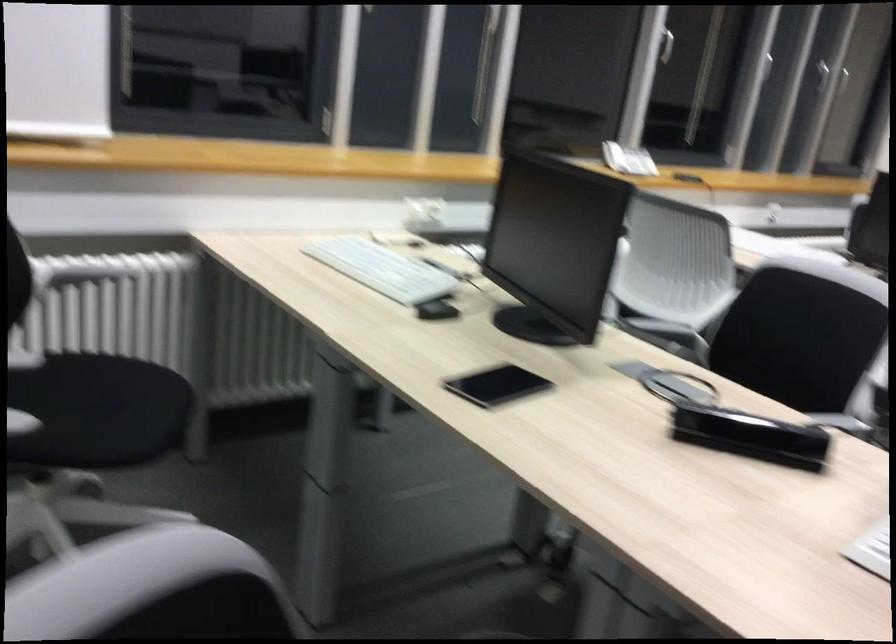
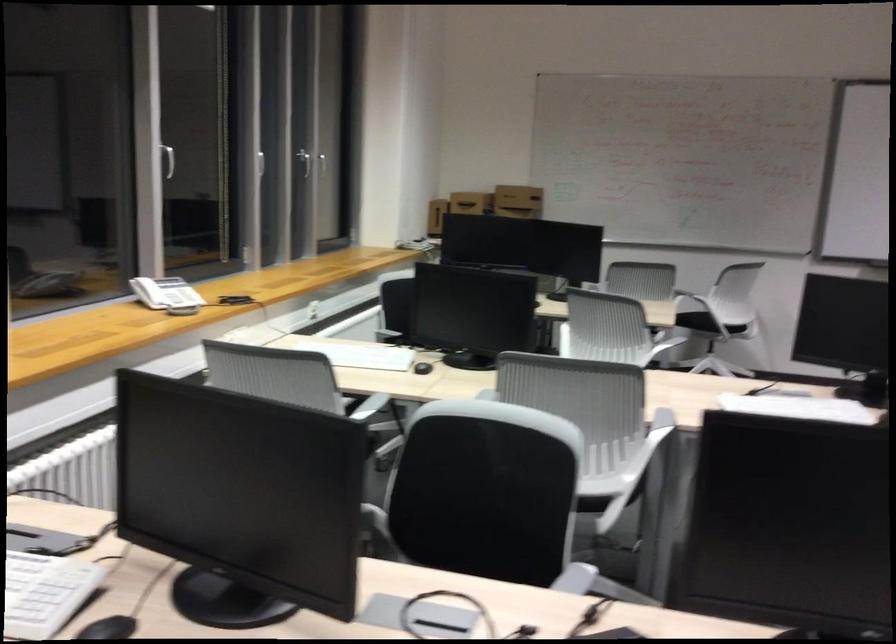
Question: The camera is either moving clockwise (left) or counter-clockwise (right) around the object. The first image is from the beginning of the video and the second image is from the end. Is the camera moving left or right when shooting the video?

Choices:
 (A) Left
 (B) Right

Answer: (A)